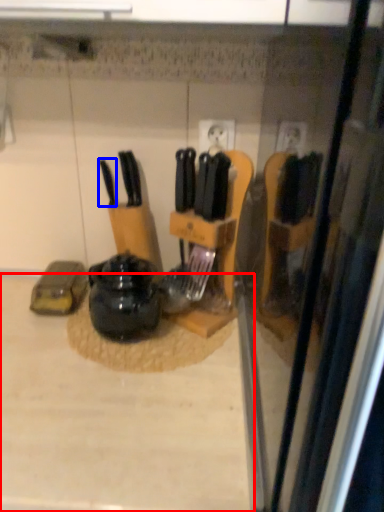
Question: Among these objects, which one is farthest to the camera, counter top (highlighted by a red box) or knife (highlighted by a blue box)?

Choices:
 (A) counter top
 (B) knife

Answer: (B)